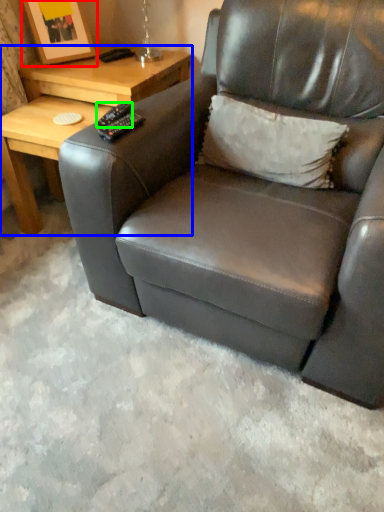
Question: Which object is the farthest from picture frame (highlighted by a red box)? Choose among these: table (highlighted by a blue box) or remote (highlighted by a green box).

Choices:
 (A) table
 (B) remote

Answer: (B)